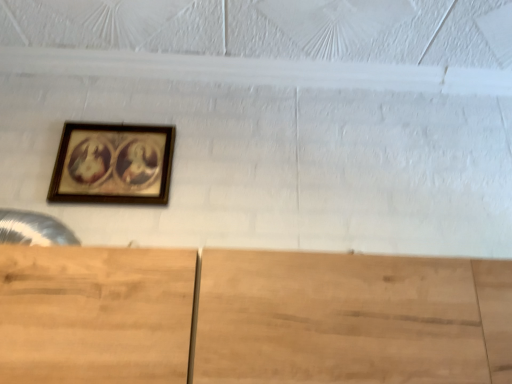
Image resolution: width=512 pixels, height=384 pixels. What do you see at coordinates (113, 164) in the screenshot?
I see `wooden framed portrait at left` at bounding box center [113, 164].

Image resolution: width=512 pixels, height=384 pixels. I want to click on wooden framed portrait at left, so click(113, 164).

This screenshot has height=384, width=512. Find the location of `wooden framed portrait at left`. wooden framed portrait at left is located at coordinates (113, 164).